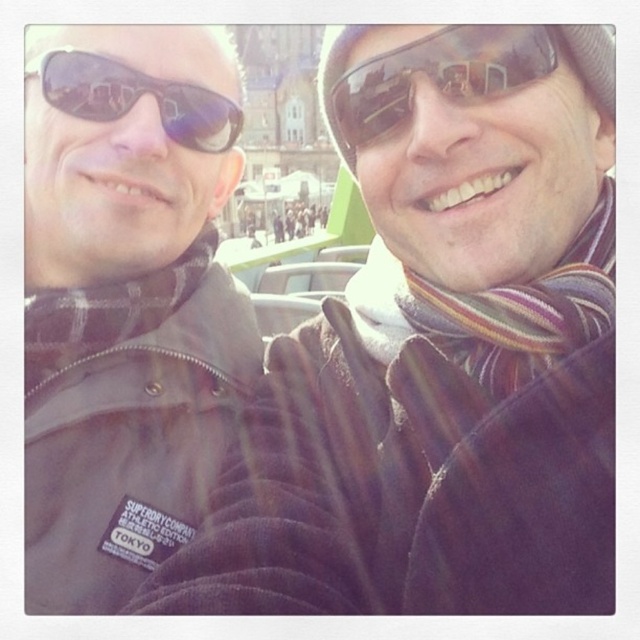
You are a photographer trying to capture the matte black jacket at left in the image. Given the coordinates provided in the Objects Description, can you determine if the jacket is positioned within the central focus area of the camera frame, which is defined as the center point at coordinates 0.5, 0.5 with a radius of 0.1?

The matte black jacket at left is located at coordinates (440, 349). The central focus area has a center at (320, 320) with a radius of 0.1. Calculating the distance between the jacket and the center, the Euclidean distance is sqrt squared difference between x and y coordinates. The distance is sqrt of squared difference between 0.547 and 0.5 is 0.047 squared, and between 0.688 and 0.5 is 0.188 squared. Adding those gives 0.002209 plus 0.035344 equals 0.037553. The square root of that is approximately 0.193

You are a photographer trying to capture a clear shot of both the matte black goggles at upper center and the matte black sunglasses at upper left. Since both are in the frame, which one would you focus on first to ensure sharpness?

You should focus on the matte black goggles at upper center first because it is closer to the viewer than the matte black sunglasses at upper left, so focusing on the closer object ensures sharpness for both if they are in the same focal plane.